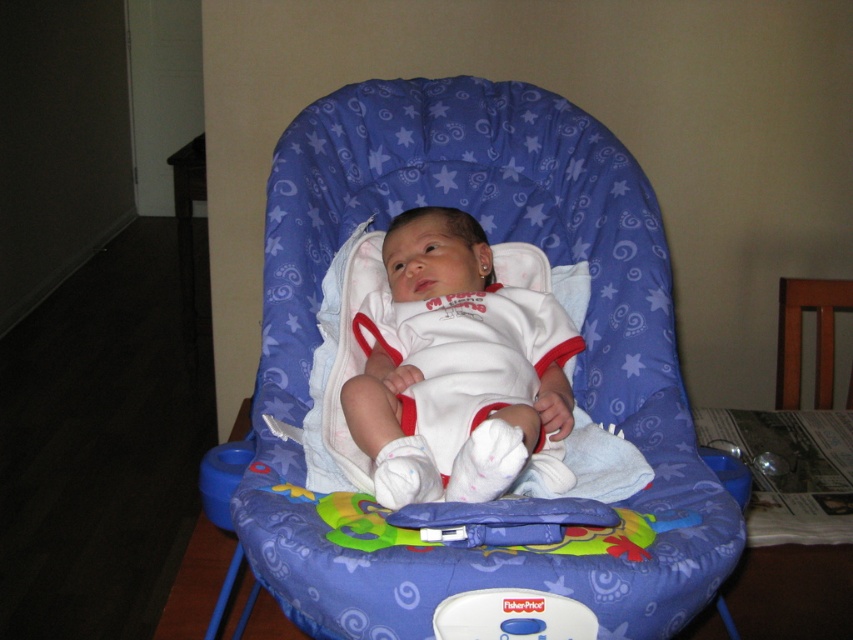
You are a photographer trying to capture a closeup of the blue fabric baby carriage at center. Your camera has a minimum focusing distance of 30 inches. Can you take the photo without moving the camera or the carriage?

The blue fabric baby carriage at center and camera are 31.71 inches apart, which is beyond the camera minimum focusing distance of 30 inches. Therefore, you can take the photo without moving the camera or the carriage.

Based on the scene description, where is the white soft fabric baby at center located in terms of coordinates?

The white soft fabric baby at center is located at coordinates point (456,368).